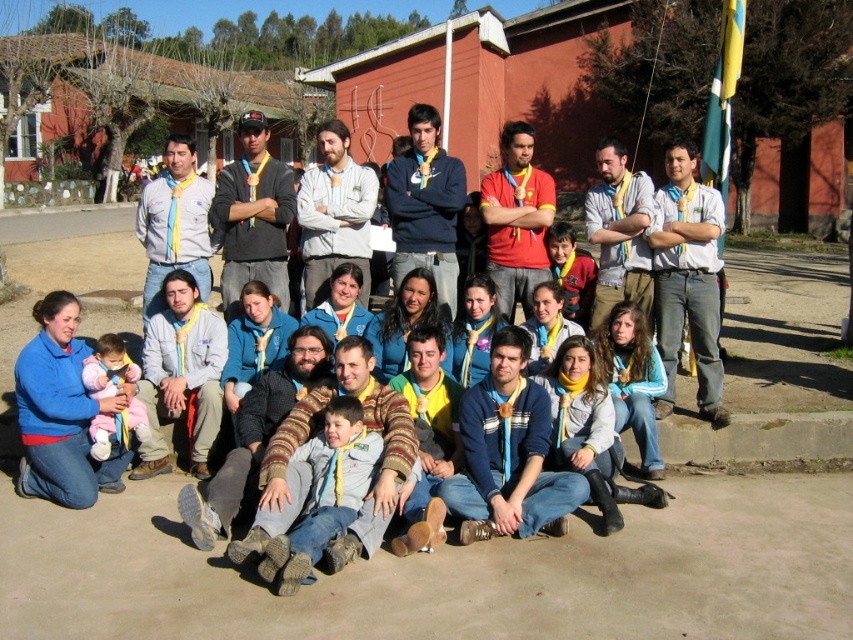
Based on the photo, you need to decide which clothing item has a wider width when looking at the group photo. Based on the scene, which one is wider between the light blue shirt at center and the white fleece jacket at center?

The light blue shirt at center has a larger width than the white fleece jacket at center according to the description.

You are standing at the bottom left corner of the image. You want to find the light blue shirt at center. In which direction should you look to see it?

The light blue shirt at center is located at coordinates approximately 0.436 along the horizontal axis and 0.807 along the vertical axis. Since you are at the bottom left corner, looking towards the center of the image would place it to your upper right direction.